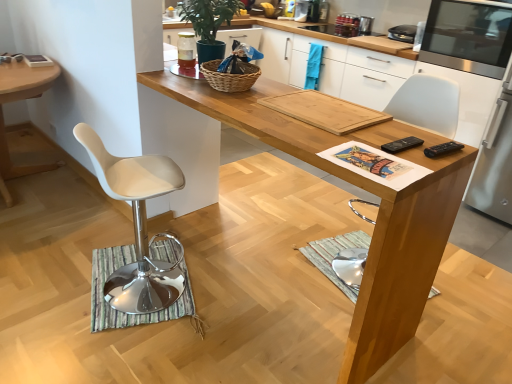
Question: Does woven brown basket at center have a larger size compared to metallic silver toaster at upper center, the 2th appliance from the left?

Choices:
 (A) yes
 (B) no

Answer: (A)

Question: Are woven brown basket at center and metallic silver toaster at upper center, the 2th appliance from the left, beside each other?

Choices:
 (A) yes
 (B) no

Answer: (B)

Question: Is metallic silver toaster at upper center, placed as the third appliance when sorted from right to left, a part of woven brown basket at center?

Choices:
 (A) yes
 (B) no

Answer: (B)

Question: From the image's perspective, is woven brown basket at center under metallic silver toaster at upper center, placed as the third appliance when sorted from right to left?

Choices:
 (A) yes
 (B) no

Answer: (A)

Question: Is the position of woven brown basket at center less distant than that of metallic silver toaster at upper center, the 2th appliance from the left?

Choices:
 (A) yes
 (B) no

Answer: (A)

Question: Do you think clear glass jar at upper center, which is the 4th appliance from right to left, is within green matte plant at upper center, or outside of it?

Choices:
 (A) inside
 (B) outside

Answer: (A)

Question: From a real-world perspective, is clear glass jar at upper center, which is the 4th appliance from right to left, above or below green matte plant at upper center?

Choices:
 (A) above
 (B) below

Answer: (B)

Question: From the image's perspective, relative to green matte plant at upper center, is clear glass jar at upper center, the first appliance when ordered from left to right, above or below?

Choices:
 (A) below
 (B) above

Answer: (A)

Question: From their relative heights in the image, would you say clear glass jar at upper center, which is the 4th appliance from right to left, is taller or shorter than green matte plant at upper center?

Choices:
 (A) short
 (B) tall

Answer: (A)

Question: In terms of width, does stainless steel microwave at right, the 1th appliance when ordered from right to left, look wider or thinner when compared to wooden cutting board at center?

Choices:
 (A) thin
 (B) wide

Answer: (B)

Question: Considering their positions, is stainless steel microwave at right, the 1th appliance when ordered from right to left, located in front of or behind wooden cutting board at center?

Choices:
 (A) front
 (B) behind

Answer: (A)

Question: In terms of size, does stainless steel microwave at right, arranged as the 4th appliance when viewed from the left, appear bigger or smaller than wooden cutting board at center?

Choices:
 (A) small
 (B) big

Answer: (A)

Question: In the image, is stainless steel microwave at right, arranged as the 4th appliance when viewed from the left, on the left side or the right side of wooden cutting board at center?

Choices:
 (A) right
 (B) left

Answer: (A)

Question: In terms of size, does white plastic chair at left, the 1th desk from the left, appear bigger or smaller than stainless steel microwave at upper right, the third appliance in the left-to-right sequence?

Choices:
 (A) small
 (B) big

Answer: (B)

Question: From the image's perspective, is white plastic chair at left, the 1th desk from the left, above or below stainless steel microwave at upper right, the third appliance in the left-to-right sequence?

Choices:
 (A) below
 (B) above

Answer: (A)